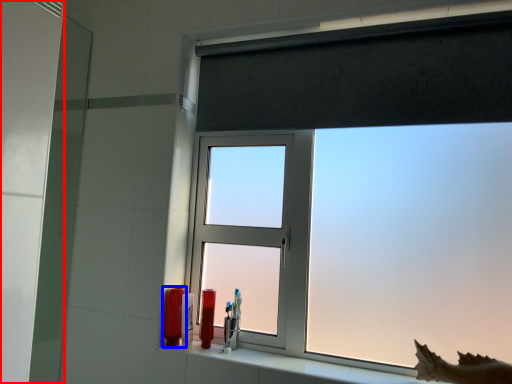
Question: Which object is closer to the camera taking this photo, screen door (highlighted by a red box) or toiletry (highlighted by a blue box)?

Choices:
 (A) screen door
 (B) toiletry

Answer: (A)